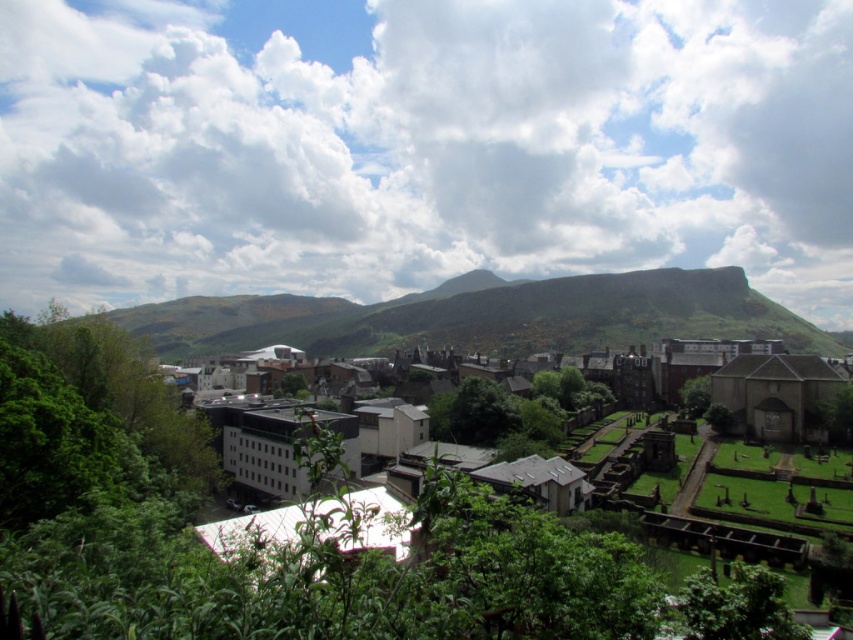
Which is above, white fluffy cloud at upper center or white matte building at center?

Positioned higher is white fluffy cloud at upper center.

Does white fluffy cloud at upper center have a lesser width compared to white matte building at center?

No, white fluffy cloud at upper center is not thinner than white matte building at center.

Does point (213, 22) come farther from viewer compared to point (809, 440)?

Yes, it is behind point (809, 440).

You are a GUI agent. You are given a task and a screenshot of the screen. Output one action in this format:
    pyautogui.click(x=<x>, y=<y>)
    Task: Click on the white fluffy cloud at upper center
    This screenshot has width=853, height=640.
    Given the screenshot: What is the action you would take?
    pyautogui.click(x=421, y=145)